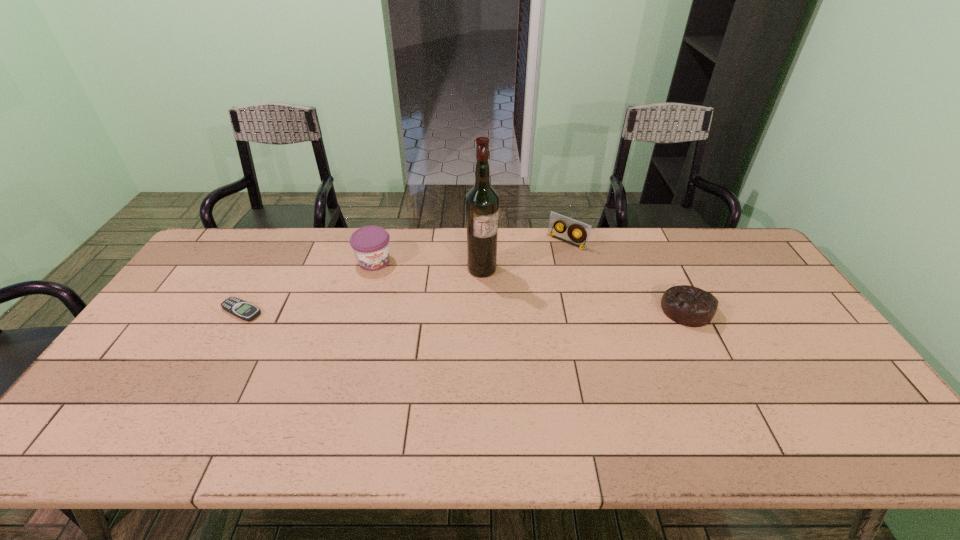
Find the location of a particular element. The height and width of the screenshot is (540, 960). videotape present at the far edge is located at coordinates (556, 220).

Where is `jam that is at the far edge`? The width and height of the screenshot is (960, 540). jam that is at the far edge is located at coordinates (370, 244).

What are the coordinates of `vacant space at the far edge of the desktop` in the screenshot? It's located at (329, 248).

In the image, there is a desktop. At what (x,y) coordinates should I click in order to perform the action: click on free space at the left edge. Please return your answer as a coordinate pair (x, y). This screenshot has height=540, width=960. Looking at the image, I should click on (186, 280).

Locate an element on the screen. This screenshot has height=540, width=960. vacant area at the right edge of the desktop is located at coordinates (815, 380).

I want to click on vacant region at the far left corner, so click(x=229, y=237).

In the image, there is a desktop. Where is `vacant space at the far right corner`? The height and width of the screenshot is (540, 960). vacant space at the far right corner is located at coordinates (748, 266).

The height and width of the screenshot is (540, 960). In the image, there is a desktop. Find the location of `vacant region at the near right corner`. vacant region at the near right corner is located at coordinates pos(800,397).

Where is `vacant area that lies between the third object from left to right and the fourth object from right to left`? This screenshot has height=540, width=960. vacant area that lies between the third object from left to right and the fourth object from right to left is located at coordinates (428, 265).

The image size is (960, 540). What are the coordinates of `vacant area between the jam and the fourth tallest object` in the screenshot? It's located at (530, 285).